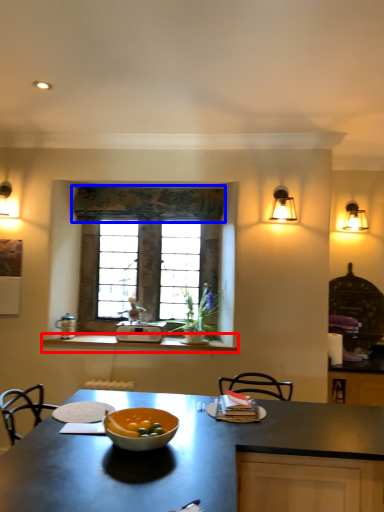
Question: Which object is further to the camera taking this photo, counter (highlighted by a red box) or curtain (highlighted by a blue box)?

Choices:
 (A) counter
 (B) curtain

Answer: (B)